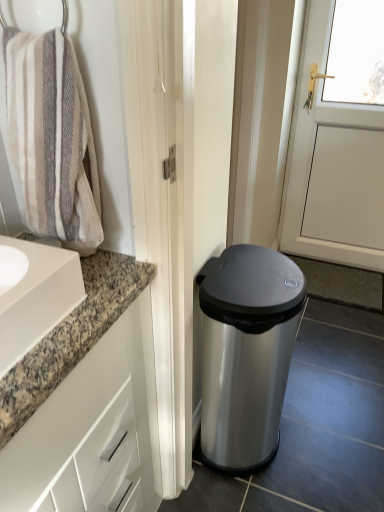
Question: Does satin silver trash can at lower right have a lesser width compared to white glossy cabinet at left?

Choices:
 (A) no
 (B) yes

Answer: (B)

Question: From the image's perspective, is satin silver trash can at lower right above white glossy cabinet at left?

Choices:
 (A) yes
 (B) no

Answer: (A)

Question: Considering the relative sizes of satin silver trash can at lower right and white glossy cabinet at left in the image provided, is satin silver trash can at lower right wider than white glossy cabinet at left?

Choices:
 (A) no
 (B) yes

Answer: (A)

Question: From the image's perspective, is satin silver trash can at lower right under white glossy cabinet at left?

Choices:
 (A) yes
 (B) no

Answer: (B)

Question: Is the position of satin silver trash can at lower right more distant than that of white glossy cabinet at left?

Choices:
 (A) yes
 (B) no

Answer: (A)

Question: Is satin silver trash can at lower right to the left of white glossy cabinet at left from the viewer's perspective?

Choices:
 (A) no
 (B) yes

Answer: (A)

Question: Is white glossy cabinet at left facing towards satin silver trash can at lower right?

Choices:
 (A) no
 (B) yes

Answer: (A)

Question: Is white glossy cabinet at left behind satin silver trash can at lower right?

Choices:
 (A) no
 (B) yes

Answer: (A)

Question: Is white glossy cabinet at left shorter than satin silver trash can at lower right?

Choices:
 (A) yes
 (B) no

Answer: (B)

Question: Considering the relative sizes of white glossy cabinet at left and satin silver trash can at lower right in the image provided, is white glossy cabinet at left smaller than satin silver trash can at lower right?

Choices:
 (A) yes
 (B) no

Answer: (B)

Question: Is white glossy cabinet at left placed right next to satin silver trash can at lower right?

Choices:
 (A) yes
 (B) no

Answer: (B)

Question: Is white glossy cabinet at left oriented away from satin silver trash can at lower right?

Choices:
 (A) no
 (B) yes

Answer: (A)

Question: Is beige textured towel at left looking in the opposite direction of satin silver trash can at lower right?

Choices:
 (A) yes
 (B) no

Answer: (B)